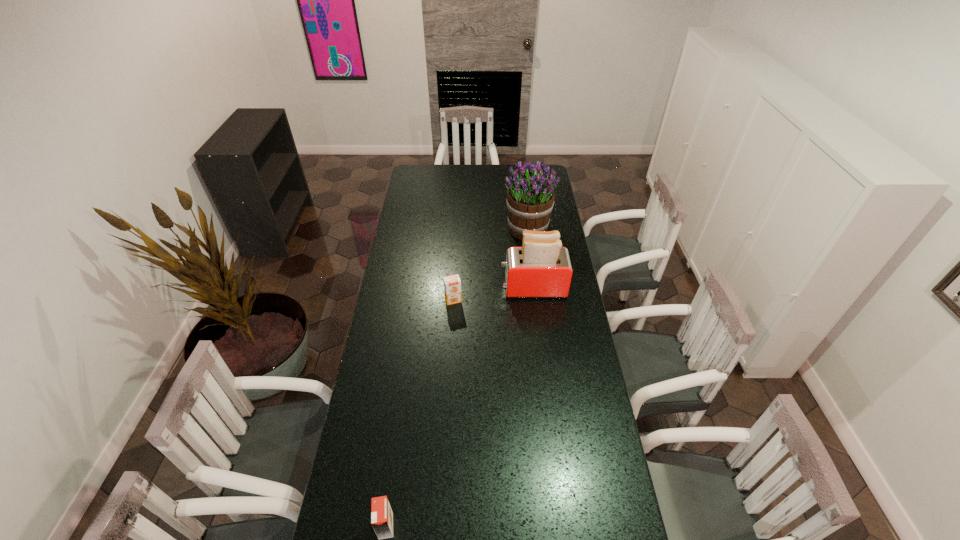
In order to click on the farthest object in this screenshot , I will do `click(530, 197)`.

Image resolution: width=960 pixels, height=540 pixels. What are the coordinates of `bouquet` in the screenshot? It's located at (530, 197).

Locate an element on the screen. the third shortest object is located at coordinates (541, 268).

The height and width of the screenshot is (540, 960). What are the coordinates of `the farther orange juice` in the screenshot? It's located at (452, 284).

The width and height of the screenshot is (960, 540). I want to click on the right orange juice, so click(452, 284).

This screenshot has height=540, width=960. In order to click on the nearer orange juice in this screenshot , I will do `click(381, 513)`.

Find the location of `the left orange juice`. the left orange juice is located at coordinates (381, 513).

This screenshot has height=540, width=960. What are the coordinates of `vacant space located 0.120m on the left of the bouquet` in the screenshot? It's located at (480, 228).

You are a GUI agent. You are given a task and a screenshot of the screen. Output one action in this format:
    pyautogui.click(x=<x>, y=<y>)
    Task: Click on the vacant area located 0.260m on the front-facing side of the toaster
    The width and height of the screenshot is (960, 540).
    Given the screenshot: What is the action you would take?
    pyautogui.click(x=443, y=288)

The width and height of the screenshot is (960, 540). What are the coordinates of `free spot located on the front-facing side of the toaster` in the screenshot? It's located at (445, 288).